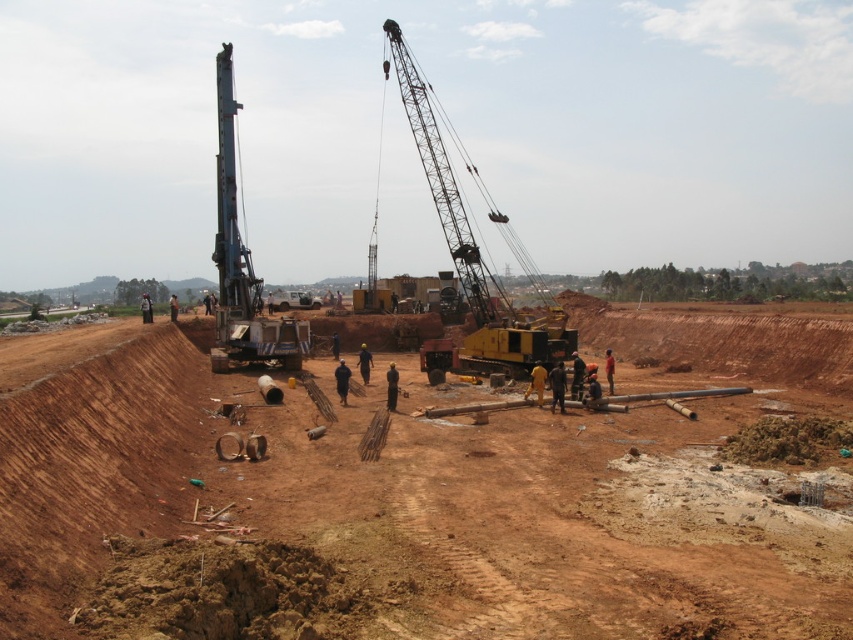
You are a construction worker standing at the edge of the trench. You notice two points marked in the image, point (527, 346) and point (229, 97). Which point is physically closer to your current position?

Point (527, 346) is closer to the camera than point (229, 97), so the point (527, 346) is physically closer to your current position.

You are an engineer assessing the construction site. You need to determine if the metallic yellow crane at center can be moved closer to the trench without overlapping the metallic gray drilling rig at left. Given their widths, can the crane be positioned between the rig and the trench?

The metallic yellow crane at center has a smaller width than the metallic gray drilling rig at left. Therefore, it can be moved closer to the trench as long as there is sufficient space between the rig and the trench to accommodate its narrower frame.

You are an inspector evaluating the construction site. You notice the brown dirt at lower left and the metallic gray drilling rig at left. Which object takes up more area in the image?

The metallic gray drilling rig at left occupies more space than the brown dirt at lower left according to the description.